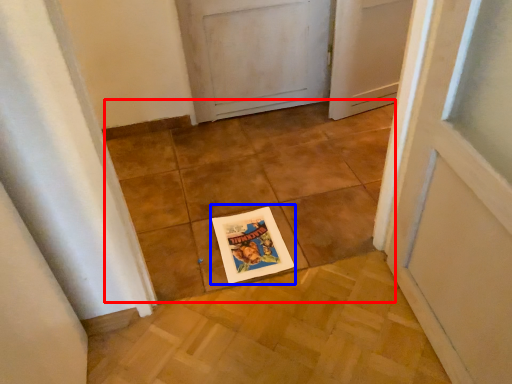
Question: Which of the following is the closest to the observer, tile (highlighted by a red box) or postcard (highlighted by a blue box)?

Choices:
 (A) tile
 (B) postcard

Answer: (A)